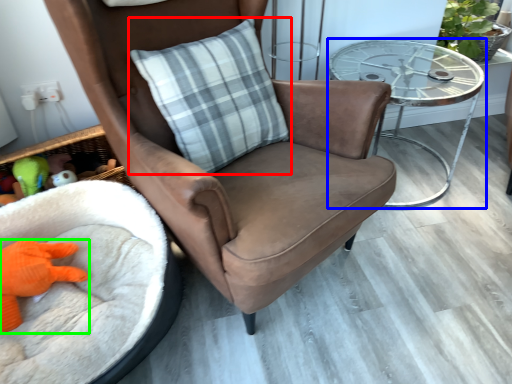
Question: Which is nearer to the pillow (highlighted by a red box)? table (highlighted by a blue box) or toy (highlighted by a green box).

Choices:
 (A) table
 (B) toy

Answer: (A)